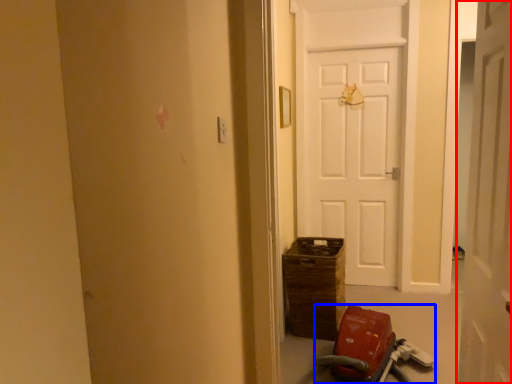
Question: Which object is closer to the camera taking this photo, door (highlighted by a red box) or baby carriage (highlighted by a blue box)?

Choices:
 (A) door
 (B) baby carriage

Answer: (A)